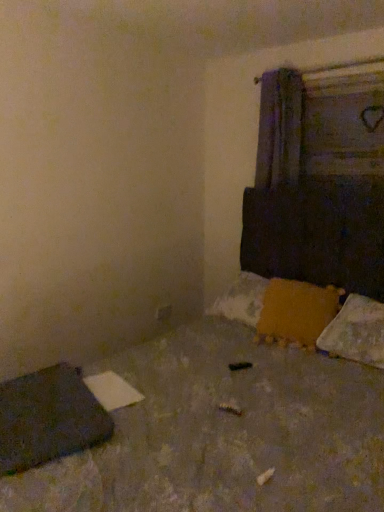
Question: From the image's perspective, is concrete textured floor at lower left positioned above or below dark gray fabric at lower left?

Choices:
 (A) below
 (B) above

Answer: (B)

Question: Is concrete textured floor at lower left bigger or smaller than dark gray fabric at lower left?

Choices:
 (A) big
 (B) small

Answer: (A)

Question: Which object is the closest to the orange fuzzy pillow at lower right, arranged as the first pillow when viewed from the left?

Choices:
 (A) dark gray fabric at lower left
 (B) concrete textured floor at lower left
 (C) white fluffy pillow at lower right, which is counted as the 1th pillow, starting from the right

Answer: (C)

Question: Considering the real-world distances, which object is farthest from the concrete textured floor at lower left?

Choices:
 (A) dark gray fabric at lower left
 (B) white fluffy pillow at lower right, which is the second pillow from left to right
 (C) orange fuzzy pillow at lower right, arranged as the first pillow when viewed from the left

Answer: (C)